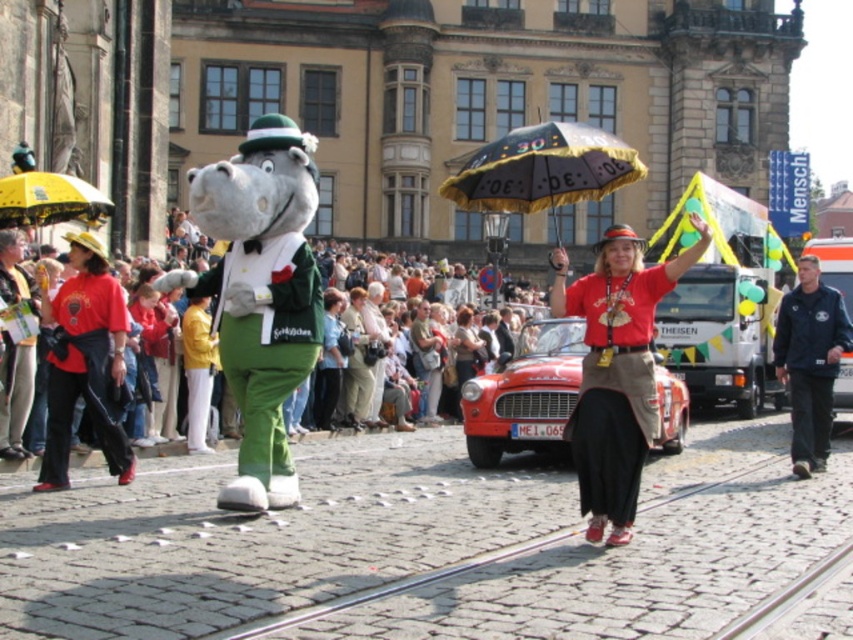
Question: Is the position of black satin umbrella at center more distant than that of yellow fabric umbrella at upper left?

Choices:
 (A) no
 (B) yes

Answer: (A)

Question: Estimate the real-world distances between objects in this image. Which object is closer to the dark blue uniform at right?

Choices:
 (A) black satin umbrella at center
 (B) red cotton shirt at center

Answer: (B)

Question: Does red cotton shirt at center have a larger size compared to black satin umbrella at center?

Choices:
 (A) yes
 (B) no

Answer: (B)

Question: Which point is closer to the camera?

Choices:
 (A) dark blue uniform at right
 (B) yellow fabric umbrella at upper left
 (C) shiny red car at center

Answer: (C)

Question: Which of the following is the closest to the observer?

Choices:
 (A) (488, 410)
 (B) (30, 209)
 (C) (592, 301)

Answer: (C)

Question: Is shiny red car at center smaller than yellow fabric umbrella at upper left?

Choices:
 (A) yes
 (B) no

Answer: (B)